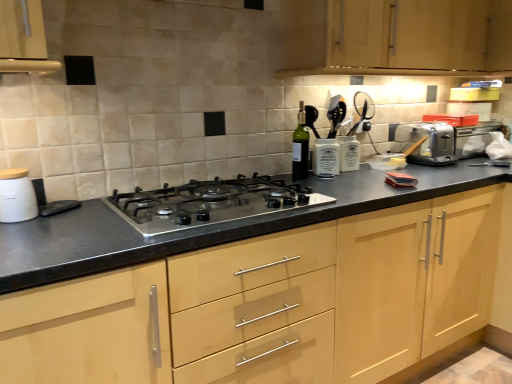
Where is `empty space that is in between satin black gas stove at center and white matte canister at left`? The width and height of the screenshot is (512, 384). empty space that is in between satin black gas stove at center and white matte canister at left is located at coordinates (83, 221).